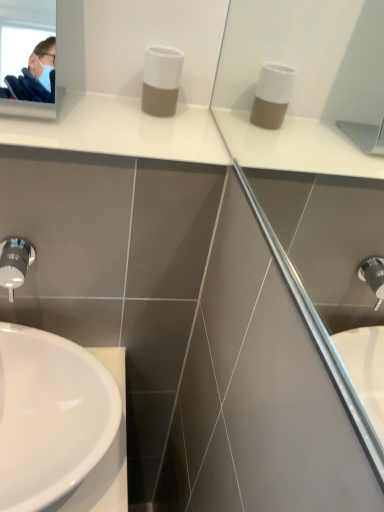
Question: Is white glossy sink at lower left spatially inside white matte soap dispenser at center, or outside of it?

Choices:
 (A) outside
 (B) inside

Answer: (A)

Question: Looking at their shapes, would you say white glossy sink at lower left is wider or thinner than white matte soap dispenser at center?

Choices:
 (A) wide
 (B) thin

Answer: (A)

Question: Considering the real-world distances, which object is farthest from the satin nickel faucet at lower left?

Choices:
 (A) white glossy sink at lower left
 (B) white matte soap dispenser at center

Answer: (B)

Question: Based on their relative distances, which object is farther from the satin nickel faucet at lower left?

Choices:
 (A) white glossy sink at lower left
 (B) white matte soap dispenser at center

Answer: (B)